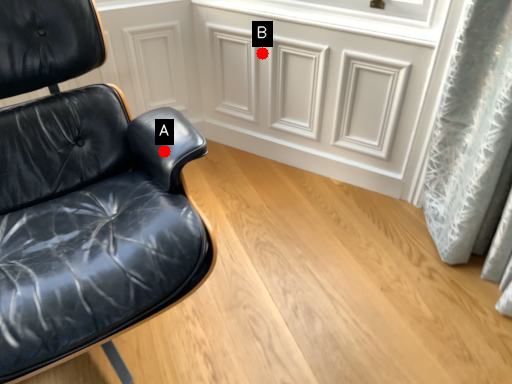
Question: Two points are circled on the image, labeled by A and B beside each circle. Which point is closer to the camera?

Choices:
 (A) A is closer
 (B) B is closer

Answer: (A)